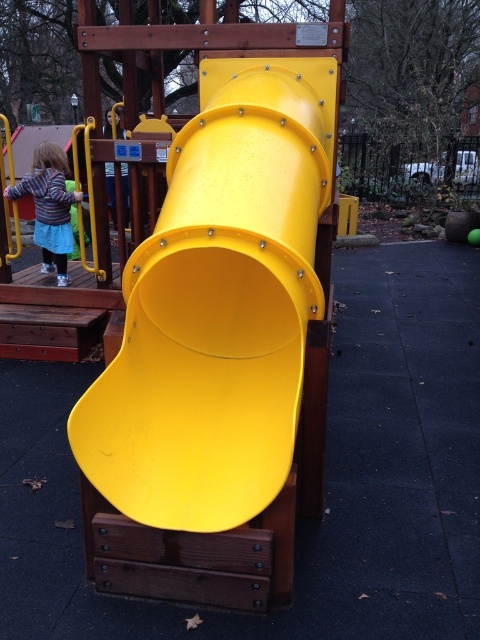
Which of these two, yellow matte slide at center or striped wool sweater at left, stands taller?

yellow matte slide at center is taller.

Is yellow matte slide at center above striped wool sweater at left?

Actually, yellow matte slide at center is below striped wool sweater at left.

What do you see at coordinates (218, 305) in the screenshot? The image size is (480, 640). I see `yellow matte slide at center` at bounding box center [218, 305].

Find the location of a particular element. The height and width of the screenshot is (640, 480). yellow matte slide at center is located at coordinates (218, 305).